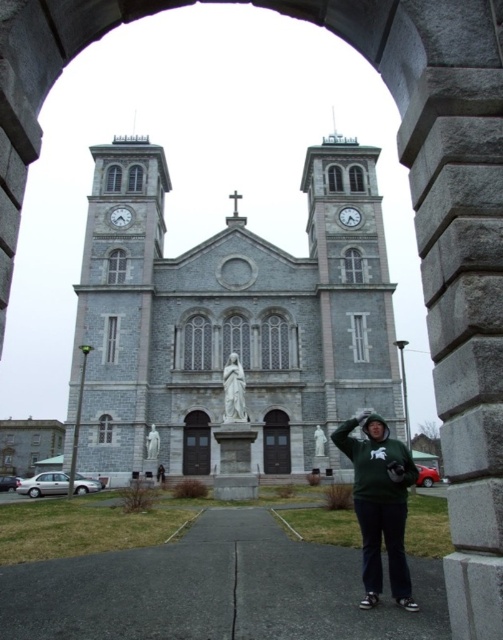
Who is shorter, gray stone church at center or green matte statue at center?

green matte statue at center is shorter.

Identify the location of gray stone church at center. (229, 320).

Is white marble statue at center wider than green matte statue at center?

Indeed, white marble statue at center has a greater width compared to green matte statue at center.

Does point (223, 416) come closer to viewer compared to point (318, 428)?

No, (223, 416) is behind (318, 428).

What are the coordinates of `white marble statue at center` in the screenshot? It's located at (233, 390).

Who is taller, green hoodie at center or green matte statue at center?

Standing taller between the two is green hoodie at center.

Describe the element at coordinates (379, 502) in the screenshot. This screenshot has width=503, height=640. I see `green hoodie at center` at that location.

This screenshot has height=640, width=503. I want to click on green hoodie at center, so click(x=379, y=502).